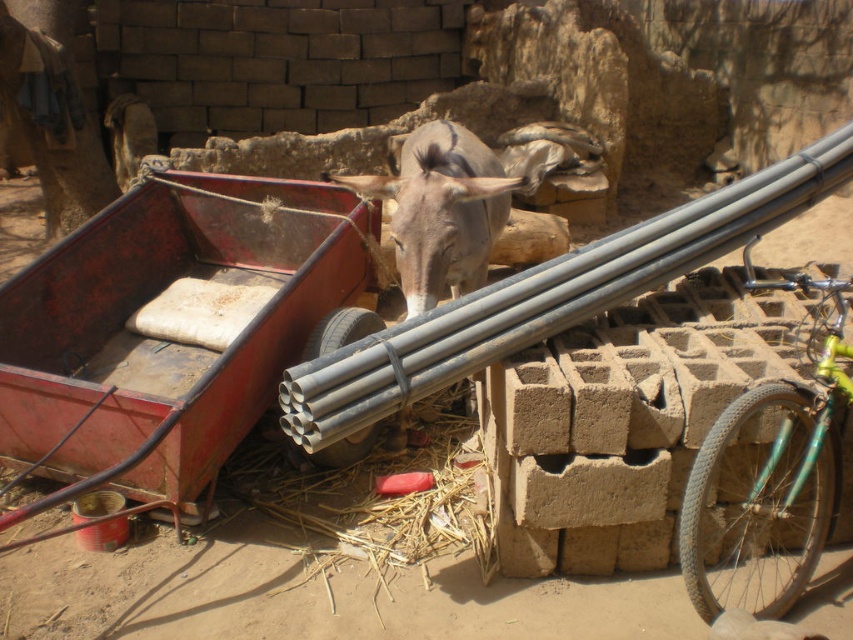
Question: Among these points, which one is nearest to the camera?

Choices:
 (A) (706, 572)
 (B) (483, 170)

Answer: (A)

Question: Is green matte bicycle at right positioned in front of gray matte donkey at center?

Choices:
 (A) yes
 (B) no

Answer: (A)

Question: Can you confirm if green matte bicycle at right is wider than gray matte donkey at center?

Choices:
 (A) no
 (B) yes

Answer: (B)

Question: Can you confirm if green matte bicycle at right is bigger than gray matte donkey at center?

Choices:
 (A) no
 (B) yes

Answer: (B)